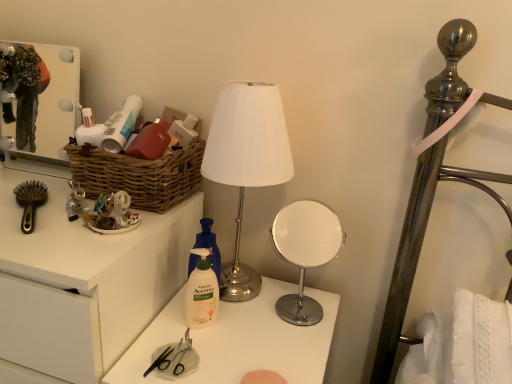
Identify the location of free spot behind white matte lotion at center, positioned as the second toiletry in left-to-right order. This screenshot has width=512, height=384. (226, 299).